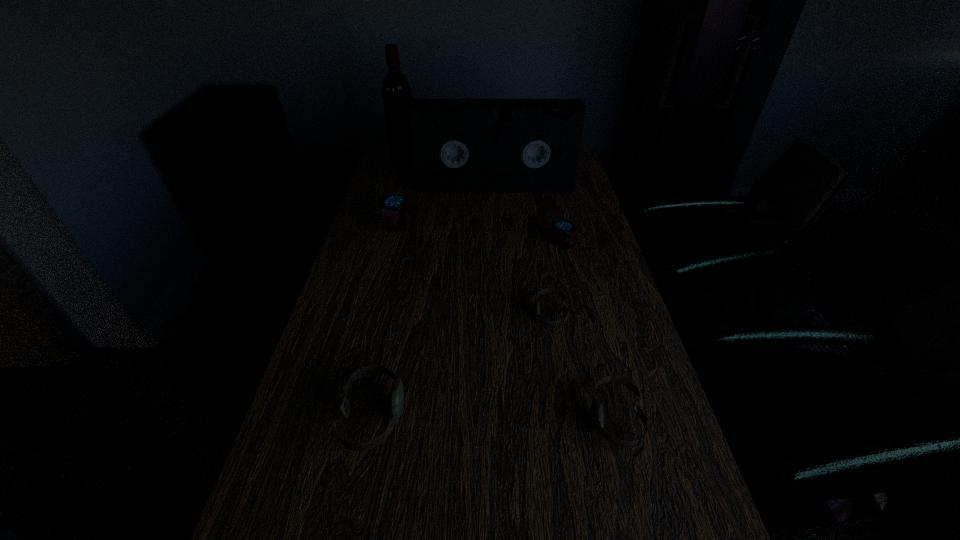
The image size is (960, 540). I want to click on vacant region located on the face of the fourth tallest watch, so click(x=527, y=418).

The image size is (960, 540). In order to click on vacant space located on the face of the smallest beige watch in this screenshot , I will do `click(479, 313)`.

Find the location of a particular element. This screenshot has height=540, width=960. free spot located on the face of the smallest beige watch is located at coordinates (390, 313).

At what (x,y) coordinates should I click in order to perform the action: click on free space located 0.200m on the face of the smallest beige watch. Please return your answer as a coordinate pair (x, y). Looking at the image, I should click on (456, 313).

At what (x,y) coordinates should I click in order to perform the action: click on object present at the far edge. Please return your answer as a coordinate pair (x, y). Looking at the image, I should click on (396, 91).

This screenshot has width=960, height=540. I want to click on wine bottle located in the left edge section of the desktop, so click(396, 91).

At what (x,y) coordinates should I click in order to perform the action: click on videotape located at the left edge. Please return your answer as a coordinate pair (x, y). Looking at the image, I should click on (458, 145).

Find the location of a particular element. This screenshot has height=540, width=960. videotape that is at the right edge is located at coordinates (458, 145).

In order to click on object that is at the far left corner in this screenshot , I will do `click(396, 91)`.

I want to click on vacant space at the left edge, so click(x=373, y=351).